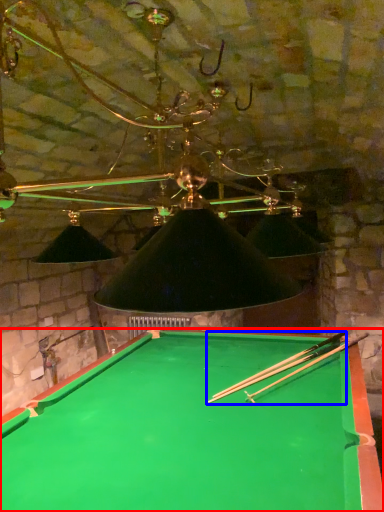
Question: Which point is closer to the camera, billiard table (highlighted by a red box) or cue (highlighted by a blue box)?

Choices:
 (A) billiard table
 (B) cue

Answer: (A)